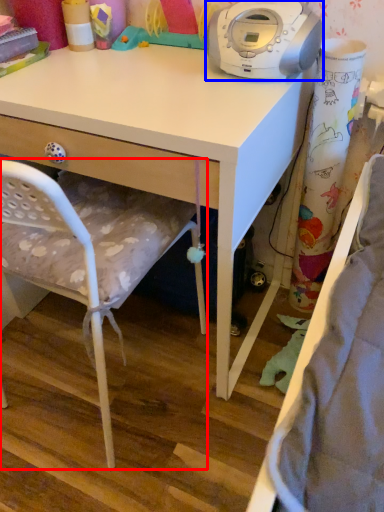
Question: Which object appears closest to the camera in this image, chair (highlighted by a red box) or home appliance (highlighted by a blue box)?

Choices:
 (A) chair
 (B) home appliance

Answer: (A)